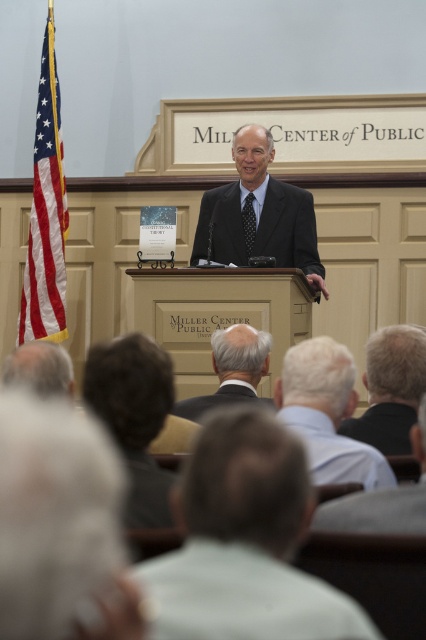
Does gray fabric head at lower left come behind black dotted tie at center?

That is False.

Does gray fabric head at lower left lie in front of black dotted tie at center?

Yes, gray fabric head at lower left is in front of black dotted tie at center.

Where is `gray fabric head at lower left`? gray fabric head at lower left is located at coordinates (134, 417).

Find the location of `gray fabric head at lower left`. gray fabric head at lower left is located at coordinates (134, 417).

Is light gray shirt at lower center positioned before light gray suit at center?

That is True.

Which is in front, point (288, 576) or point (402, 518)?

Point (288, 576)

I want to click on light gray shirt at lower center, so click(244, 544).

Which is behind, point (414, 362) or point (247, 236)?

The point (247, 236) is more distant.

Is gray hair at upper right to the left of black dotted tie at center from the viewer's perspective?

No, gray hair at upper right is not to the left of black dotted tie at center.

Is point (405, 429) in front of point (250, 246)?

Yes.

Where is `gray hair at upper right`? The width and height of the screenshot is (426, 640). gray hair at upper right is located at coordinates (391, 388).